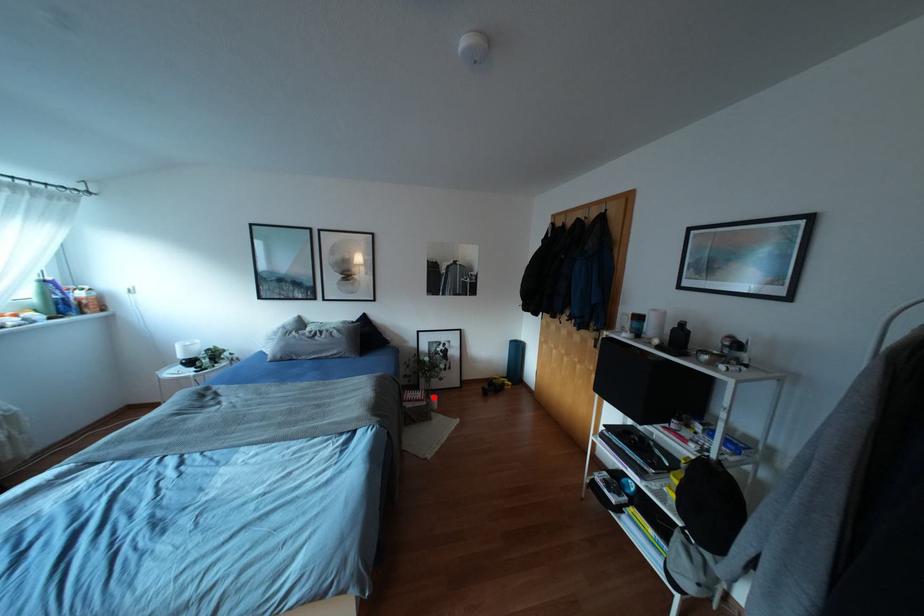
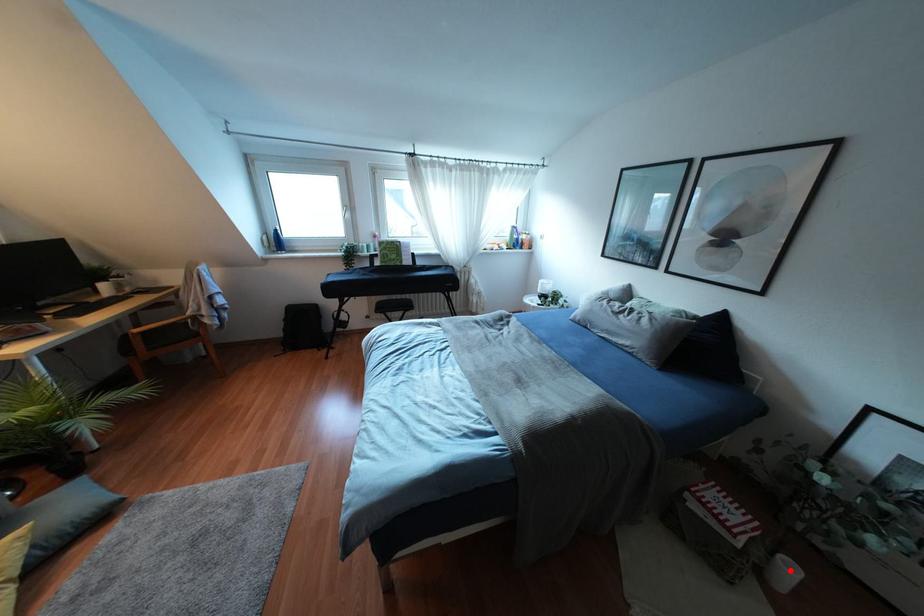
I am providing you with two images of the same scene from different viewpoints. A red point is marked on the first image and another point is marked on the second image. Does the point marked in image1 correspond to the same location as the one in image2?

Yes